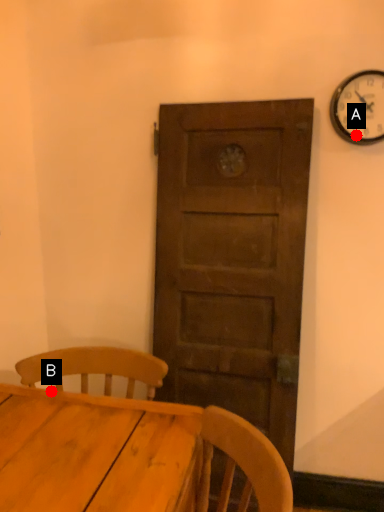
Question: Two points are circled on the image, labeled by A and B beside each circle. Which point is farther from the camera taking this photo?

Choices:
 (A) A is further
 (B) B is further

Answer: (A)